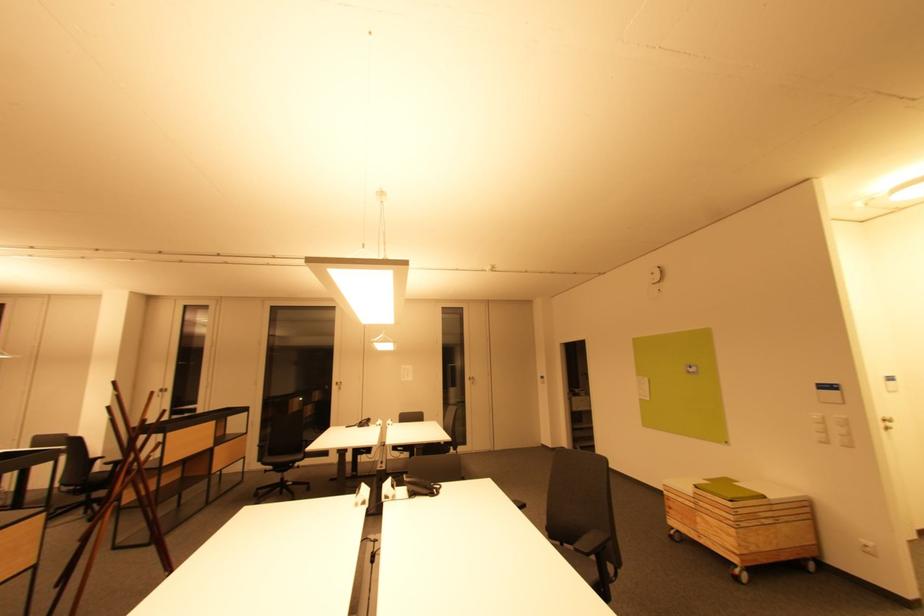
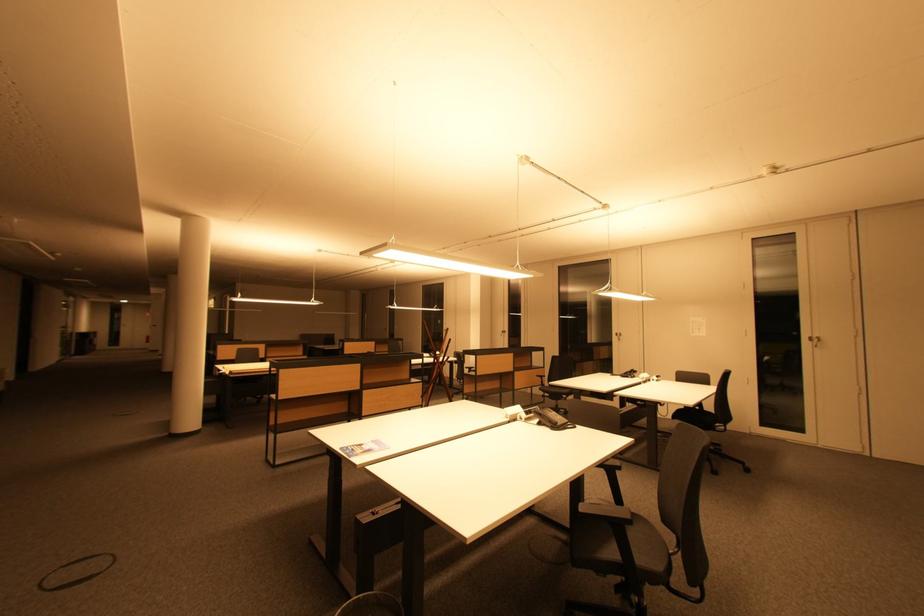
Where in the second image is the point corresponding to [473,378] from the first image?

(815, 338)